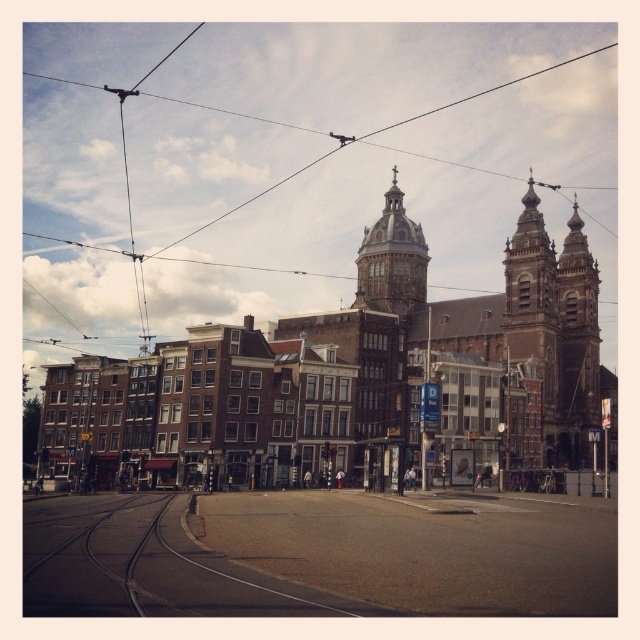
You are standing at the point with coordinates (148, 564) in the image. What type of surface are you standing on?

You are standing on smooth asphalt train track at center located at point (148, 564).